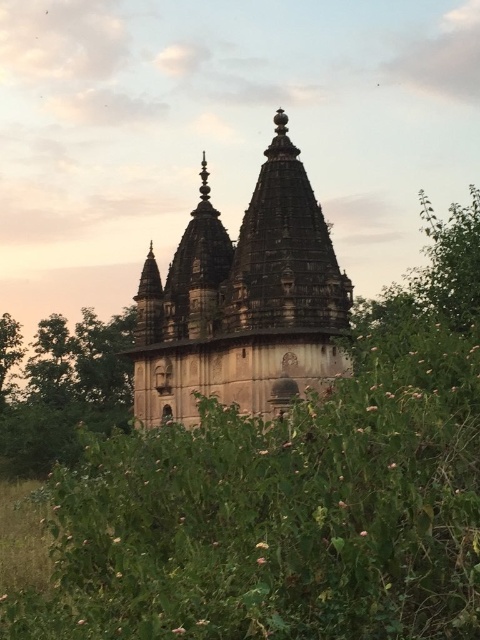
Question: Which point is farther to the camera?

Choices:
 (A) (68, 385)
 (B) (193, 256)

Answer: (A)

Question: Does stone hindu temple at center appear on the left side of green leafy tree at center?

Choices:
 (A) no
 (B) yes

Answer: (A)

Question: Can you confirm if stone hindu temple at center is bigger than green leafy tree at center?

Choices:
 (A) no
 (B) yes

Answer: (B)

Question: Is stone hindu temple at center smaller than green leafy tree at center?

Choices:
 (A) no
 (B) yes

Answer: (A)

Question: Which of the following is the closest to the observer?

Choices:
 (A) green leafy tree at center
 (B) stone hindu temple at center

Answer: (B)